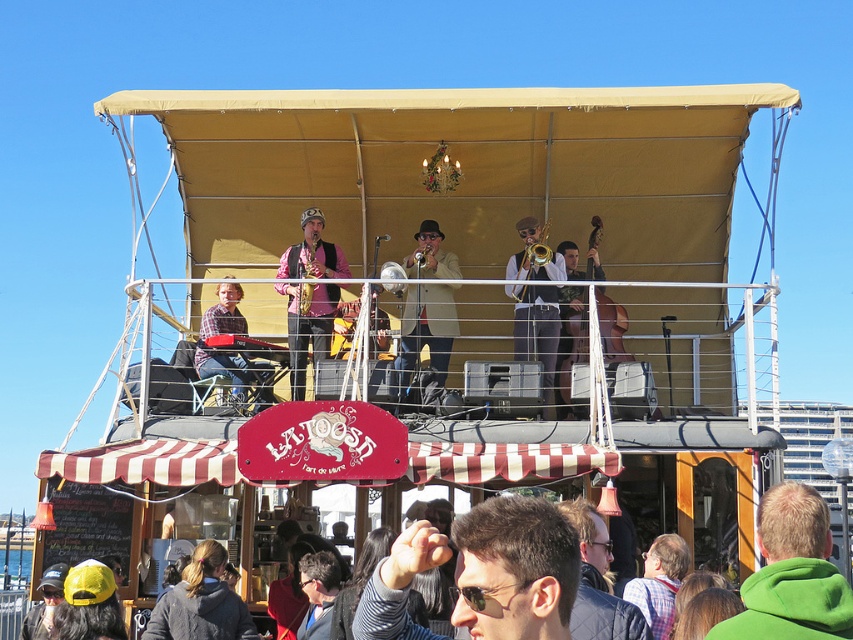
Question: Which object appears closest to the camera in this image?

Choices:
 (A) shiny gold saxophone at center
 (B) sunglasses at center
 (C) matte gold trombone at center
 (D) green fleece jacket at lower right

Answer: (B)

Question: Does green fleece jacket at lower right come behind shiny gold saxophone at center?

Choices:
 (A) yes
 (B) no

Answer: (B)

Question: Estimate the real-world distances between objects in this image. Which object is closer to the shiny gold saxophone at center?

Choices:
 (A) gold brass trumpet at upper center
 (B) brushed metal saxophone at upper center
 (C) green fleece jacket at lower right
 (D) gold metallic saxophone at center

Answer: (B)

Question: Is brushed metal saxophone at upper center bigger than gold metallic saxophone at center?

Choices:
 (A) no
 (B) yes

Answer: (B)

Question: Which object appears closest to the camera in this image?

Choices:
 (A) sunglasses at center
 (B) brushed metal saxophone at upper center
 (C) gold metallic saxophone at center
 (D) shiny gold saxophone at center

Answer: (A)

Question: Can you confirm if green fleece jacket at lower right is wider than gold metallic saxophone at center?

Choices:
 (A) no
 (B) yes

Answer: (B)